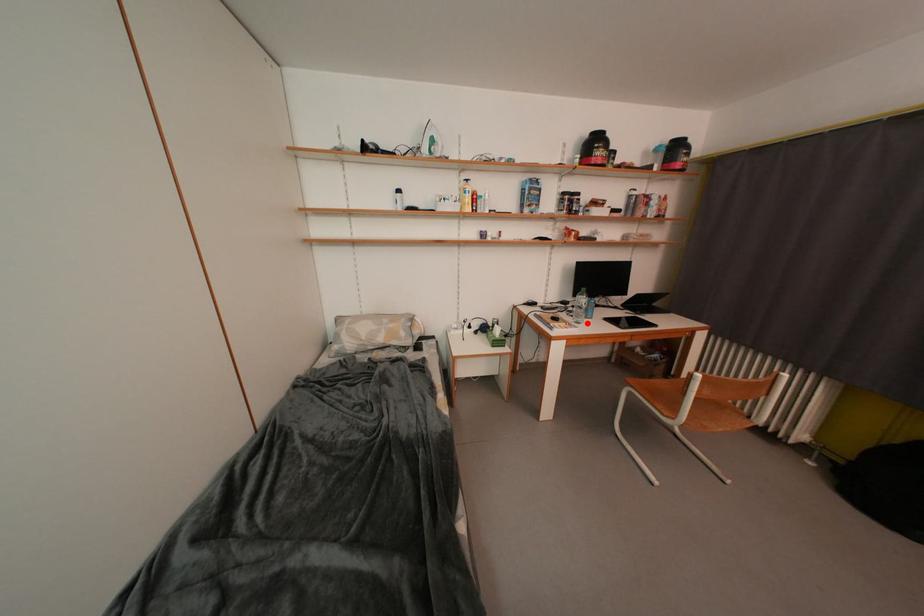
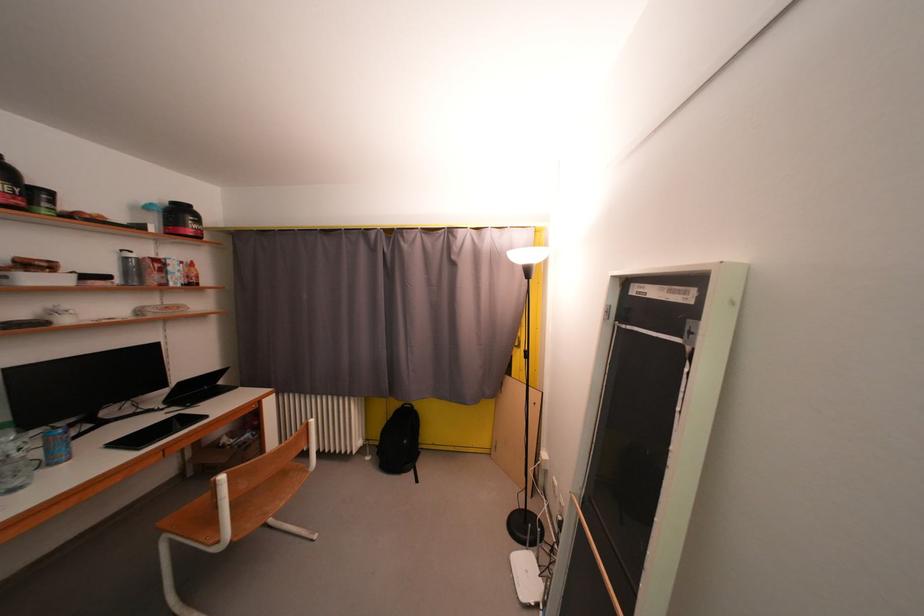
Locate, in the second image, the point that corresponds to the highlighted location in the first image.

(25, 487)